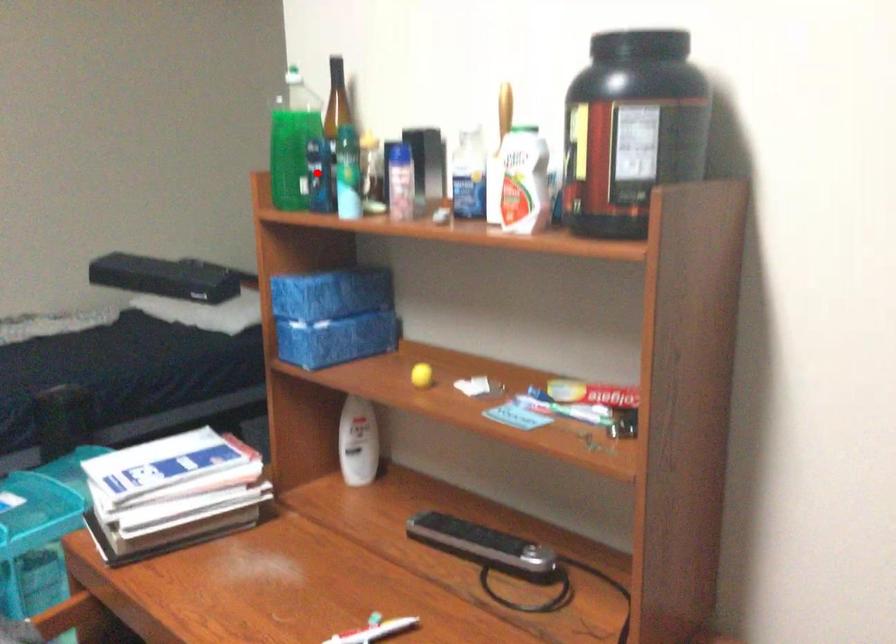
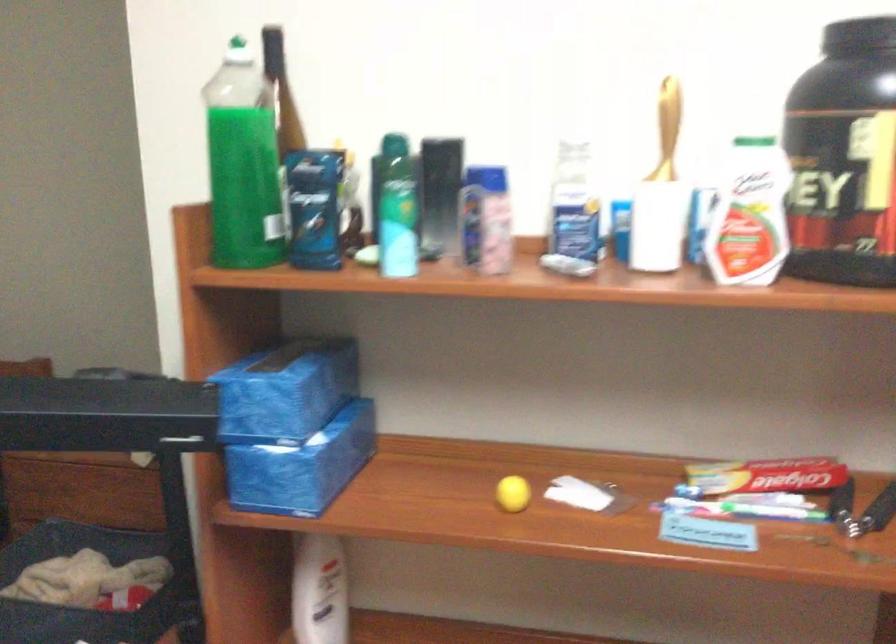
Where in the second image is the point corresponding to the highlighted location from the first image?

(314, 207)